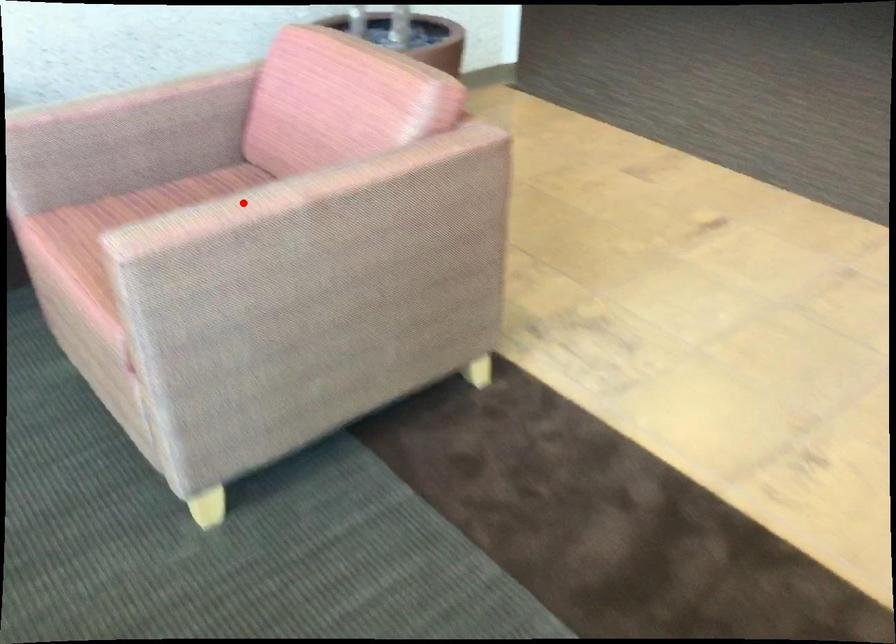
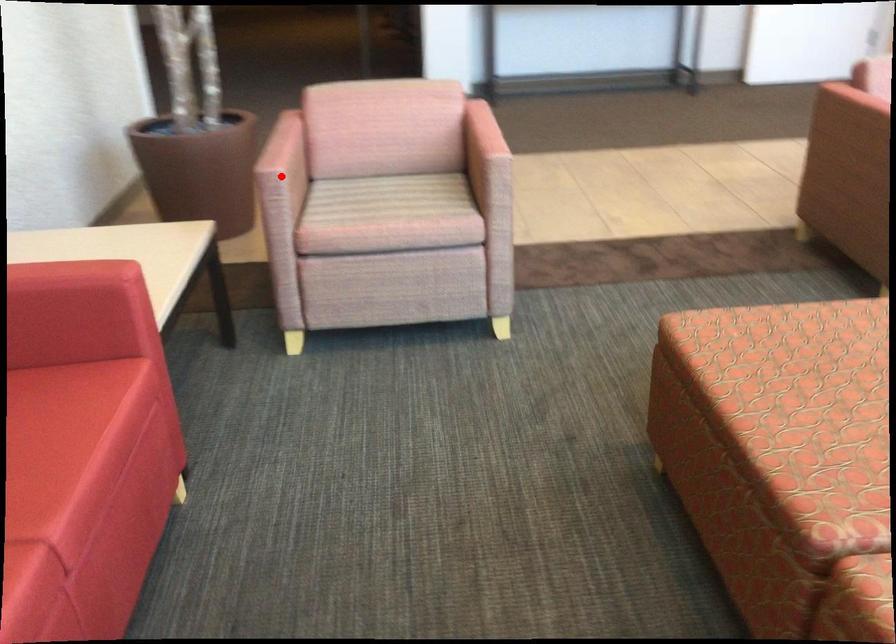
I am providing you with two images of the same scene from different viewpoints. A red point is marked on the first image and another point is marked on the second image. Are the points marked in image1 and image2 representing the same 3D position?

No